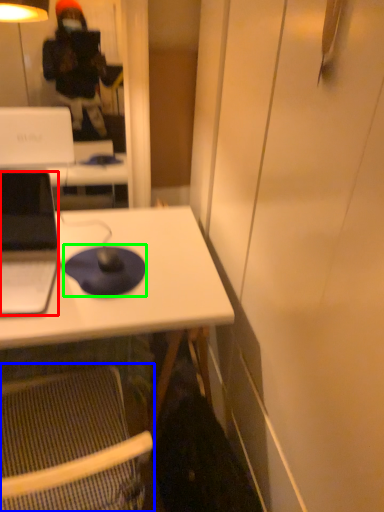
Question: Based on their relative distances, which object is nearer to laptop (highlighted by a red box)? Choose from folding chair (highlighted by a blue box) and mousepad (highlighted by a green box).

Choices:
 (A) folding chair
 (B) mousepad

Answer: (B)